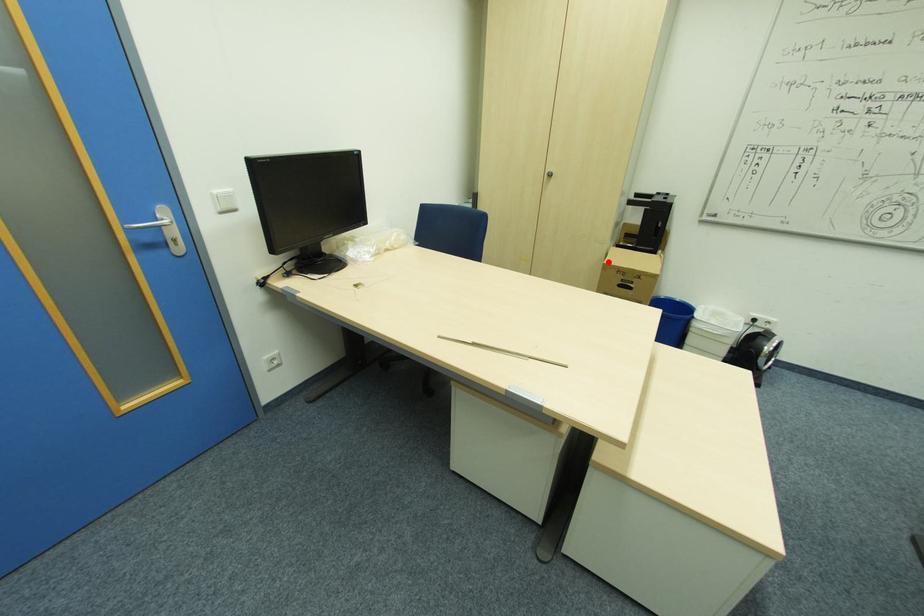
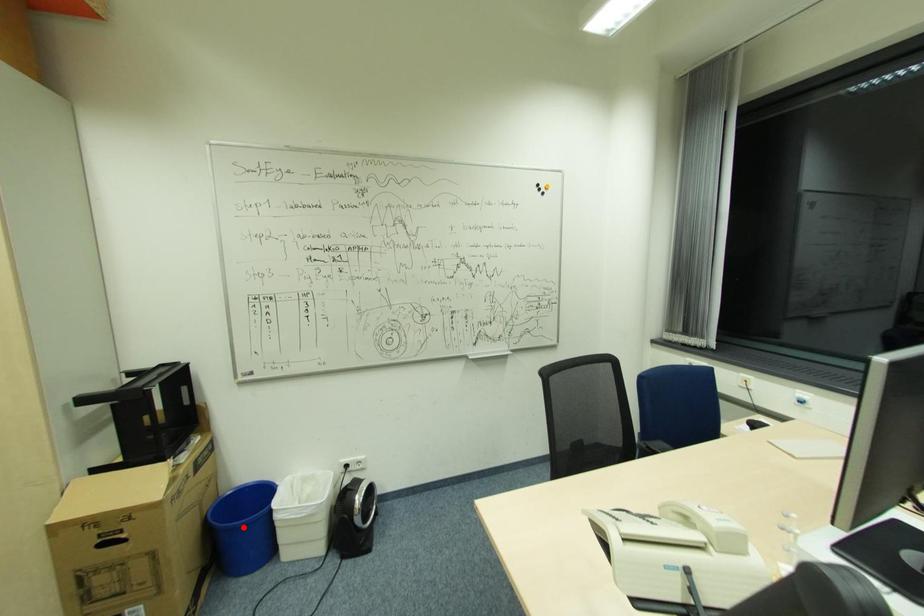
I am providing you with two images of the same scene from different viewpoints. A red point is marked on the first image and another point is marked on the second image. Is the red point in image1 aligned with the point shown in image2?

No